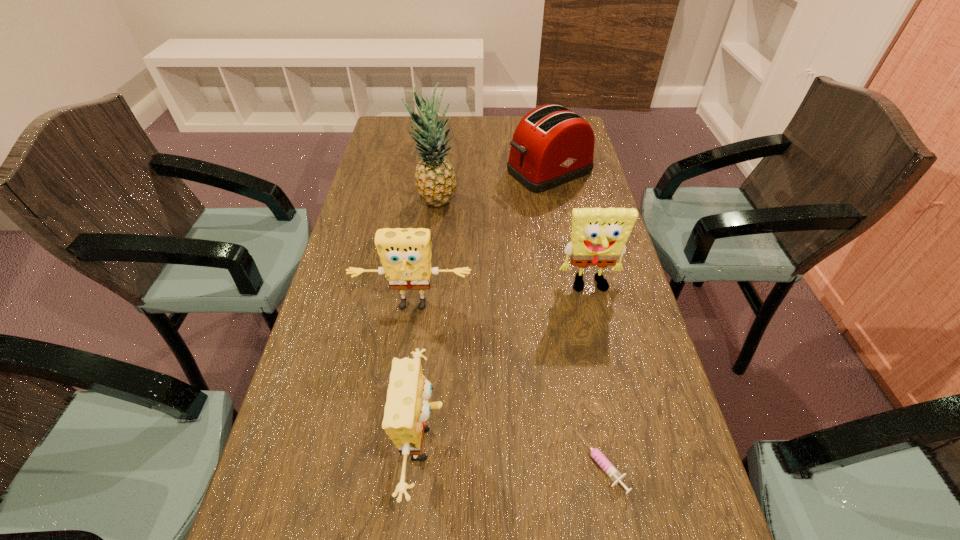
Where is `vacant area that lies between the shortest object and the rightmost sponge`? This screenshot has width=960, height=540. vacant area that lies between the shortest object and the rightmost sponge is located at coordinates click(x=595, y=374).

Image resolution: width=960 pixels, height=540 pixels. I want to click on empty location between the pineapple and the nearest sponge, so click(x=430, y=323).

Where is `unoccupied position between the nearest sponge and the shortest object`? The image size is (960, 540). unoccupied position between the nearest sponge and the shortest object is located at coordinates (513, 453).

Locate an element on the screen. The width and height of the screenshot is (960, 540). empty location between the nearest sponge and the pineapple is located at coordinates click(430, 323).

In order to click on free space between the shortest object and the nearest sponge in this screenshot , I will do `click(513, 453)`.

Point out which object is positioned as the nearest to the rightmost sponge. Please provide its 2D coordinates. Your answer should be formatted as a tuple, i.e. [(x, y)], where the tuple contains the x and y coordinates of a point satisfying the conditions above.

[(405, 254)]

Select which object appears as the closest to the toaster. Please provide its 2D coordinates. Your answer should be formatted as a tuple, i.e. [(x, y)], where the tuple contains the x and y coordinates of a point satisfying the conditions above.

[(435, 180)]

Identify which sponge is the nearest to the shortest object. Please provide its 2D coordinates. Your answer should be formatted as a tuple, i.e. [(x, y)], where the tuple contains the x and y coordinates of a point satisfying the conditions above.

[(407, 408)]

You are a GUI agent. You are given a task and a screenshot of the screen. Output one action in this format:
    pyautogui.click(x=<x>, y=<y>)
    Task: Click on the sponge that is the closest one to the toaster
    The height and width of the screenshot is (540, 960).
    Given the screenshot: What is the action you would take?
    pyautogui.click(x=599, y=235)

What are the coordinates of `vacant space that satisfies the following two spatial constraints: 1. on the face of the rightmost sponge; 2. on the face of the nearest sponge` in the screenshot? It's located at (627, 444).